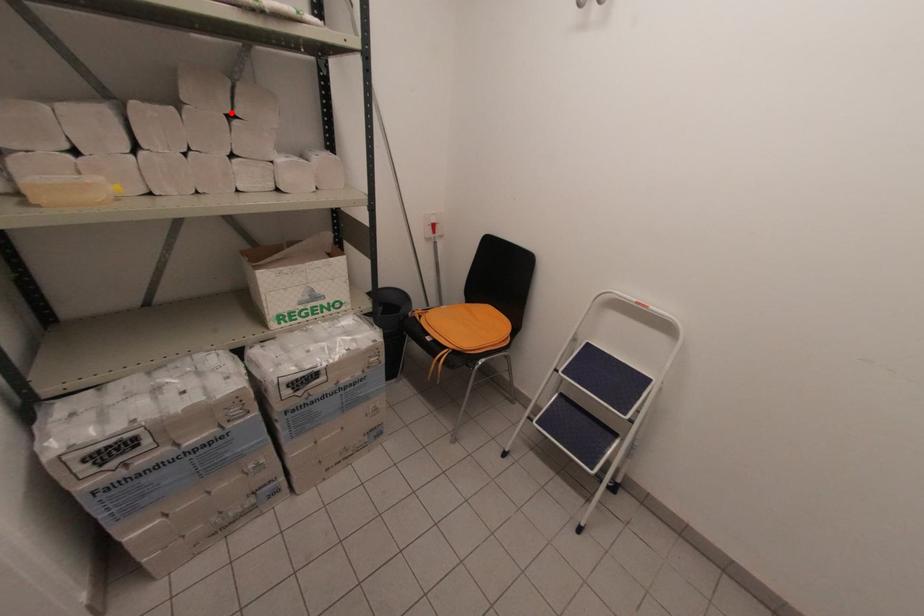
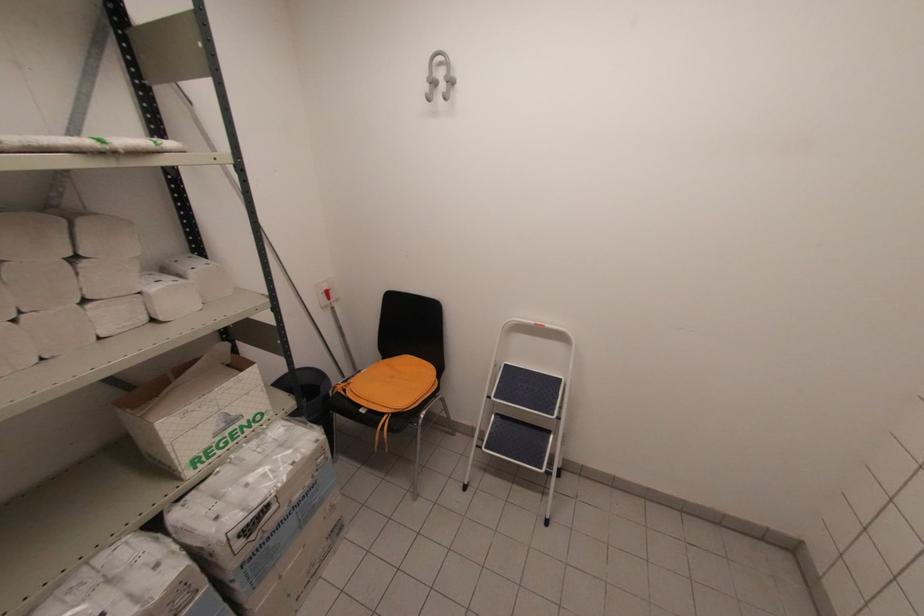
Where in the second image is the point corresponding to the highlighted location from the first image?

(71, 254)